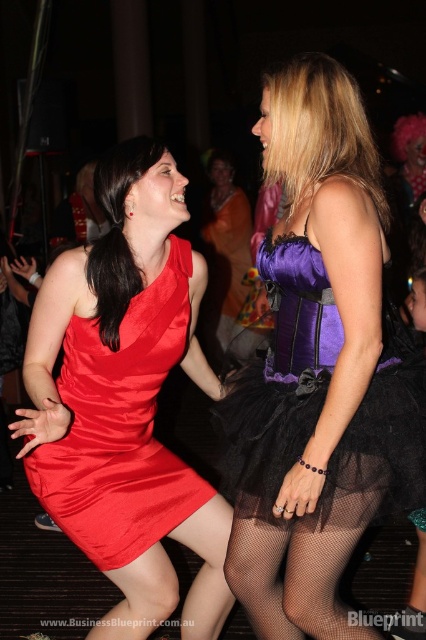
Is satin dress at left closer to the viewer compared to black fishnet tights at lower center?

That is False.

In the scene shown: Can you confirm if satin dress at left is smaller than black fishnet tights at lower center?

Incorrect, satin dress at left is not smaller in size than black fishnet tights at lower center.

Who is more forward, [146,420] or [262,600]?

Point [262,600] is in front.

The image size is (426, 640). In order to click on satin dress at left in this screenshot , I will do (x=120, y=428).

From the picture: Does purple satin dress at center have a greater width compared to satin dress at left?

In fact, purple satin dress at center might be narrower than satin dress at left.

Does purple satin dress at center have a lesser width compared to satin dress at left?

Indeed, purple satin dress at center has a lesser width compared to satin dress at left.

Is point (302, 291) closer to viewer compared to point (181, 486)?

Yes.

This screenshot has height=640, width=426. Identify the location of purple satin dress at center. tap(279, 378).

Does purple satin dress at center have a greater width compared to black fishnet tights at lower center?

Yes.

In the scene shown: Does purple satin dress at center appear under black fishnet tights at lower center?

Actually, purple satin dress at center is above black fishnet tights at lower center.

This screenshot has width=426, height=640. What do you see at coordinates (279, 378) in the screenshot?
I see `purple satin dress at center` at bounding box center [279, 378].

Image resolution: width=426 pixels, height=640 pixels. In order to click on purple satin dress at center in this screenshot , I will do `click(279, 378)`.